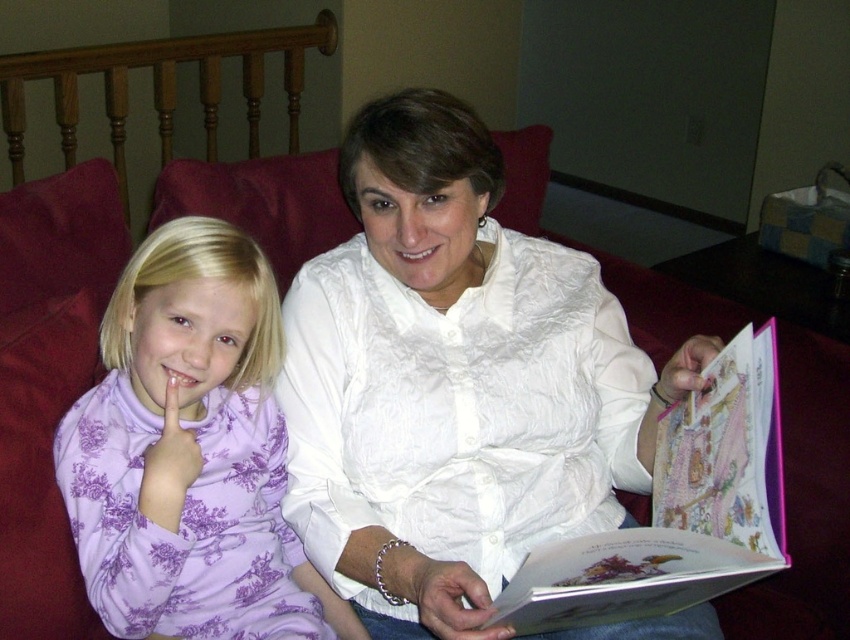
Is smooth white teeth at center to the left of pink matte lips at center from the viewer's perspective?

Incorrect, smooth white teeth at center is not on the left side of pink matte lips at center.

Who is more forward, [412,250] or [187,369]?

Positioned in front is point [187,369].

Who is more distant from viewer, (426, 243) or (202, 378)?

Positioned behind is point (426, 243).

Where is `smooth white teeth at center`? smooth white teeth at center is located at coordinates (418, 250).

Who is taller, white textured blouse at center or purple floral dress at left?

With more height is white textured blouse at center.

Who is more forward, (353, 128) or (157, 442)?

Positioned in front is point (157, 442).

Where is `white textured blouse at center`? The height and width of the screenshot is (640, 850). white textured blouse at center is located at coordinates (454, 384).

Can you confirm if white textured blouse at center is positioned above pink paper book at center?

Correct, white textured blouse at center is located above pink paper book at center.

Who is lower down, white textured blouse at center or pink paper book at center?

Positioned lower is pink paper book at center.

Describe the element at coordinates (454, 384) in the screenshot. The image size is (850, 640). I see `white textured blouse at center` at that location.

The width and height of the screenshot is (850, 640). What are the coordinates of `white textured blouse at center` in the screenshot? It's located at (454, 384).